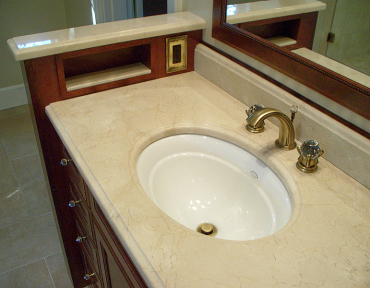
Image resolution: width=370 pixels, height=288 pixels. I want to click on sink, so click(211, 164).